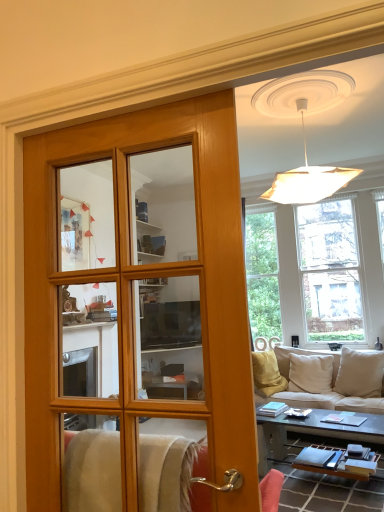
Question: Is clear glass window at upper right at the left side of wooden door at center?

Choices:
 (A) yes
 (B) no

Answer: (B)

Question: Is wooden door at center a part of clear glass window at upper right?

Choices:
 (A) no
 (B) yes

Answer: (A)

Question: Could you tell me if clear glass window at upper right is turned towards wooden door at center?

Choices:
 (A) yes
 (B) no

Answer: (A)

Question: Is clear glass window at upper right positioned beyond the bounds of wooden door at center?

Choices:
 (A) yes
 (B) no

Answer: (A)

Question: Can you confirm if clear glass window at upper right is wider than wooden door at center?

Choices:
 (A) no
 (B) yes

Answer: (B)

Question: From the image's perspective, relative to smooth black coffee table at lower right, is clear glass window at upper right above or below?

Choices:
 (A) below
 (B) above

Answer: (B)

Question: Which is correct: clear glass window at upper right is inside smooth black coffee table at lower right, or outside of it?

Choices:
 (A) outside
 (B) inside

Answer: (A)

Question: Is clear glass window at upper right bigger or smaller than smooth black coffee table at lower right?

Choices:
 (A) small
 (B) big

Answer: (B)

Question: In terms of height, does clear glass window at upper right look taller or shorter compared to smooth black coffee table at lower right?

Choices:
 (A) short
 (B) tall

Answer: (B)

Question: In the image, is smooth black coffee table at lower right on the left side or the right side of wooden door at center?

Choices:
 (A) right
 (B) left

Answer: (A)

Question: Is point (375, 415) closer or farther from the camera than point (208, 113)?

Choices:
 (A) farther
 (B) closer

Answer: (A)

Question: In terms of width, does smooth black coffee table at lower right look wider or thinner when compared to wooden door at center?

Choices:
 (A) wide
 (B) thin

Answer: (A)

Question: Based on their sizes in the image, would you say smooth black coffee table at lower right is bigger or smaller than wooden door at center?

Choices:
 (A) small
 (B) big

Answer: (B)

Question: Is point (283, 417) positioned closer to the camera than point (292, 291)?

Choices:
 (A) farther
 (B) closer

Answer: (B)

Question: Looking at their shapes, would you say smooth black coffee table at lower right is wider or thinner than clear glass window at upper right?

Choices:
 (A) thin
 (B) wide

Answer: (B)